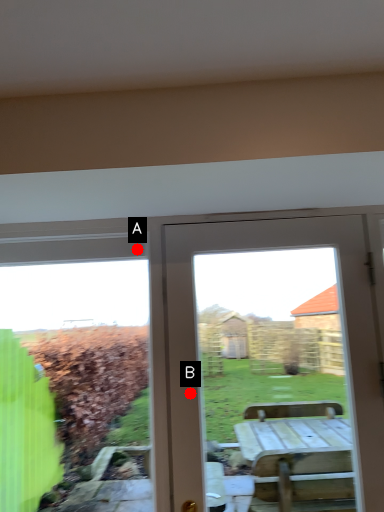
Question: Two points are circled on the image, labeled by A and B beside each circle. Which point is closer to the camera taking this photo?

Choices:
 (A) A is closer
 (B) B is closer

Answer: (B)